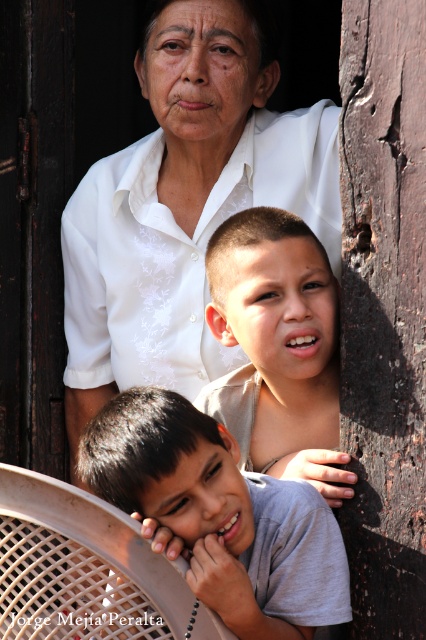
Question: Which point appears farthest from the camera in this image?

Choices:
 (A) (331, 451)
 (B) (92, 380)

Answer: (B)

Question: Can you confirm if white textured shirt at upper center is positioned below smooth beige shirt at center?

Choices:
 (A) no
 (B) yes

Answer: (A)

Question: Which point appears closest to the camera in this image?

Choices:
 (A) (339, 461)
 (B) (140, 150)

Answer: (A)

Question: Does white textured shirt at upper center come behind gray cotton shirt at lower left?

Choices:
 (A) yes
 (B) no

Answer: (A)

Question: Can you confirm if white textured shirt at upper center is positioned below gray cotton shirt at lower left?

Choices:
 (A) no
 (B) yes

Answer: (A)

Question: Which of these objects is positioned closest to the white textured shirt at upper center?

Choices:
 (A) gray cotton shirt at lower left
 (B) smooth beige shirt at center

Answer: (B)